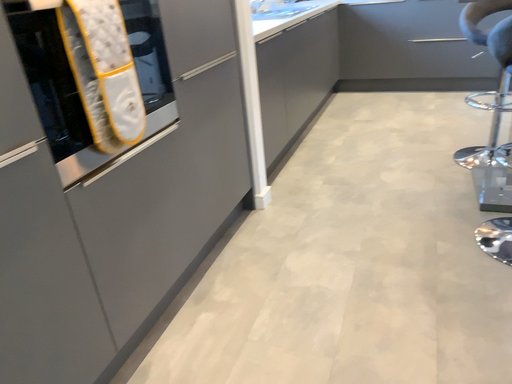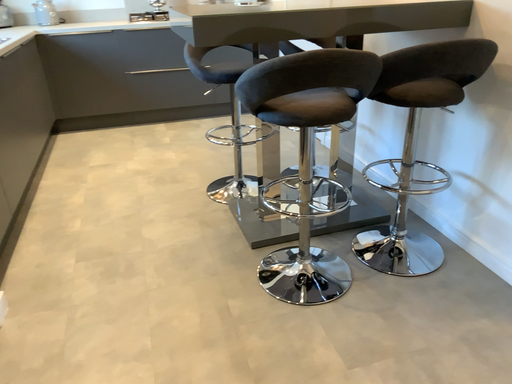
Question: Which way did the camera rotate in the video?

Choices:
 (A) rotated upward
 (B) rotated downward

Answer: (A)